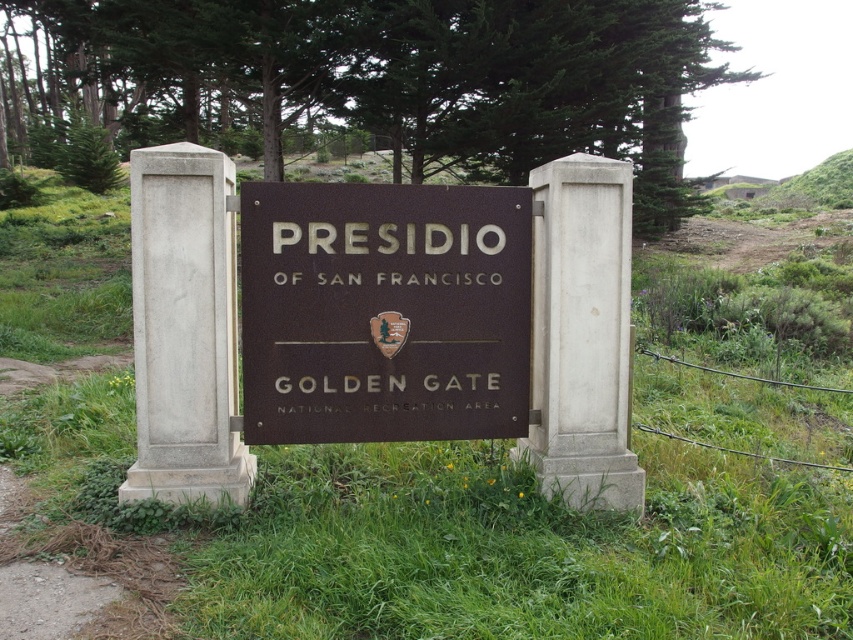
Find the location of a particular element. The height and width of the screenshot is (640, 853). brown polished wood sign at center is located at coordinates (384, 310).

The width and height of the screenshot is (853, 640). I want to click on brown polished wood sign at center, so click(384, 310).